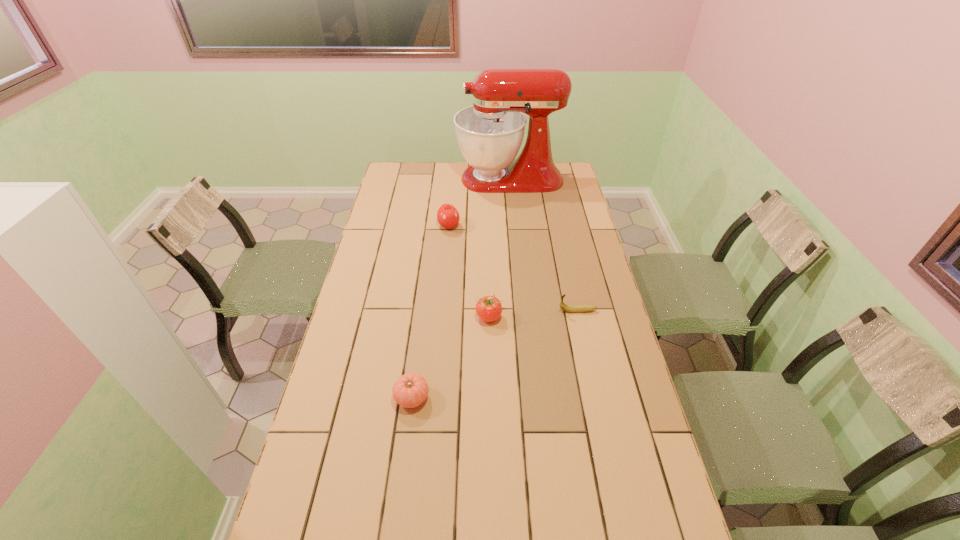
What are the coordinates of `free space between the apple and the right tomato` in the screenshot? It's located at (469, 271).

This screenshot has width=960, height=540. I want to click on free space between the apple and the farther tomato, so click(x=469, y=271).

Find the location of `free space between the banana and the nearest object`. free space between the banana and the nearest object is located at coordinates (494, 354).

You are a GUI agent. You are given a task and a screenshot of the screen. Output one action in this format:
    pyautogui.click(x=<x>, y=<y>)
    Task: Click on the vacant region between the banana and the mixer
    The width and height of the screenshot is (960, 540).
    Given the screenshot: What is the action you would take?
    pyautogui.click(x=543, y=245)

Select which object appears as the third closest to the banana. Please provide its 2D coordinates. Your answer should be formatted as a tuple, i.e. [(x, y)], where the tuple contains the x and y coordinates of a point satisfying the conditions above.

[(448, 217)]

In order to click on the third closest object to the left tomato in this screenshot , I will do `click(448, 217)`.

At what (x,y) coordinates should I click in order to perform the action: click on vacant space that satisfies the following two spatial constraints: 1. at the stem of the banana; 2. on the front side of the nearest object. Please return your answer as a coordinate pair (x, y). Looking at the image, I should click on (596, 397).